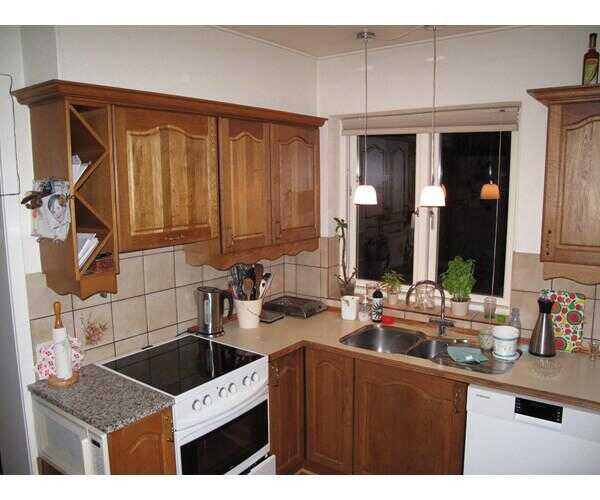
Locate an element on the screen. The height and width of the screenshot is (500, 600). white walls is located at coordinates (307, 80).